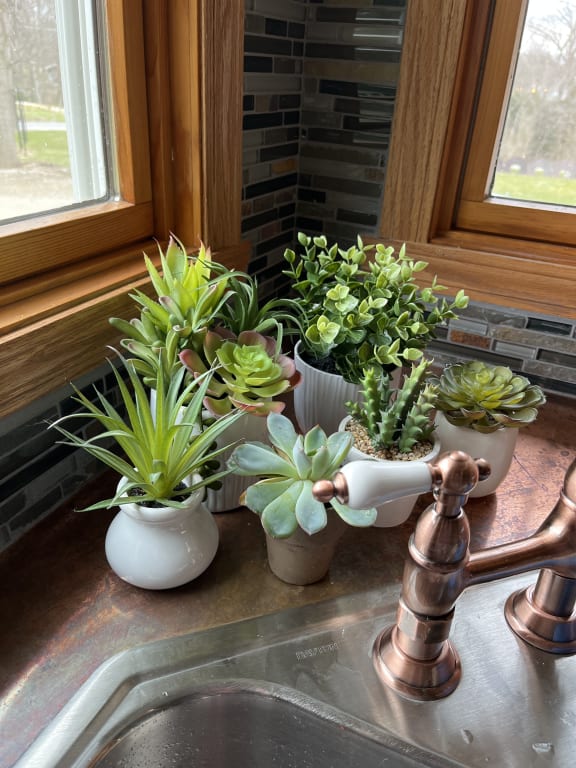
I want to click on copper sink extension, so click(x=77, y=633).